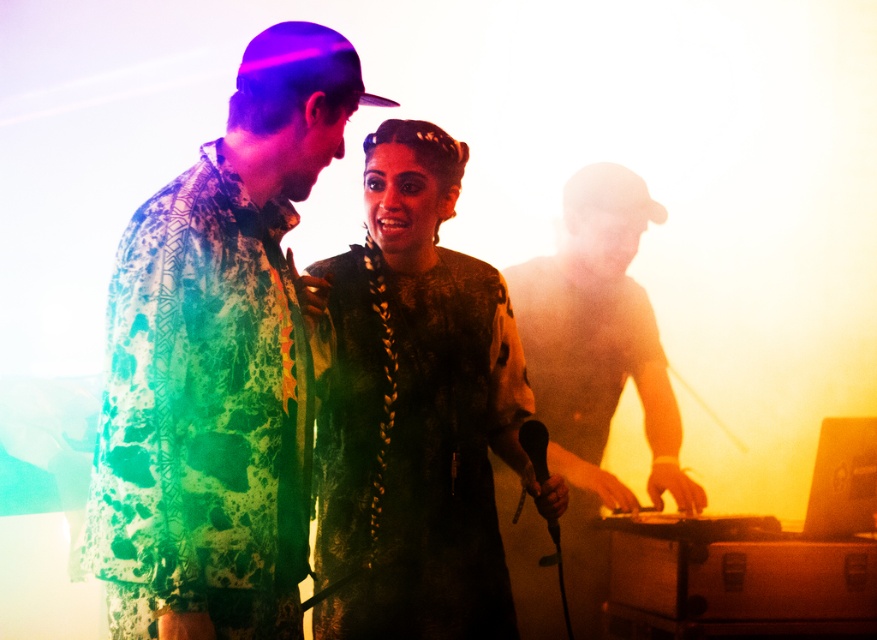
Based on the scene description, where is the printed fabric shirt at center located in the image?

The printed fabric shirt at center is located at point 0.570 on the x axis and 0.250 on the y axis.

You are a photographer at a live music event. You need to capture a photo where the velvet black dress at center is framed above the shiny metallic dj deck at right. Is this possible based on their current positions?

The velvet black dress at center is not as tall as the shiny metallic dj deck at right, so it would be difficult to frame the velvet black dress at center above the shiny metallic dj deck at right since it is shorter.